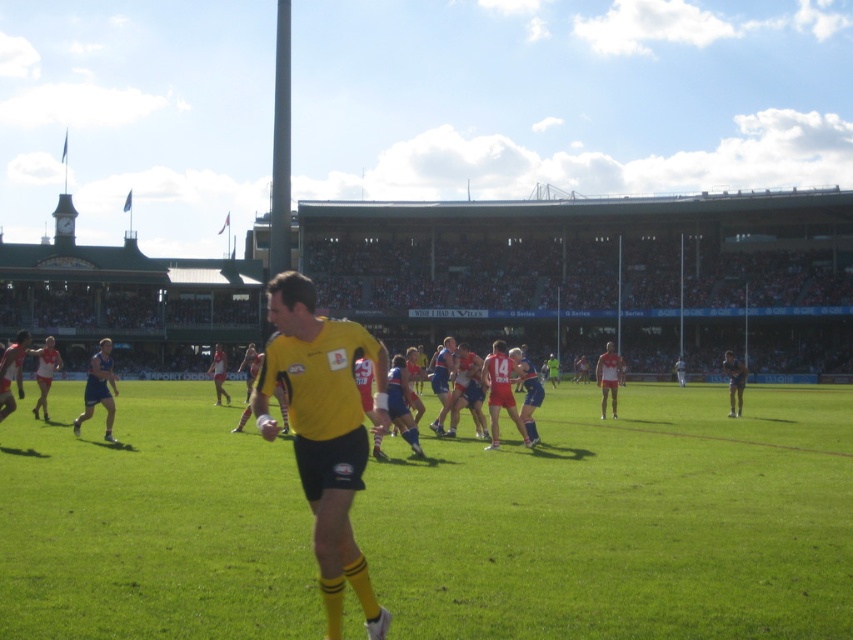
Question: Does blue uniform at center appear on the right side of blue jersey at center?

Choices:
 (A) yes
 (B) no

Answer: (B)

Question: Which object is closer to the camera taking this photo?

Choices:
 (A) blue uniform at center
 (B) matte blue shorts at right

Answer: (A)

Question: Is blue jersey at center wider than matte blue shorts at right?

Choices:
 (A) no
 (B) yes

Answer: (A)

Question: Is yellow jersey at center positioned at the back of matte blue shorts at right?

Choices:
 (A) yes
 (B) no

Answer: (B)

Question: Among these objects, which one is farthest from the camera?

Choices:
 (A) matte blue shorts at right
 (B) yellow matte jersey at center

Answer: (A)

Question: Which point is closer to the camera taking this photo?

Choices:
 (A) (730, 385)
 (B) (642, 509)

Answer: (B)